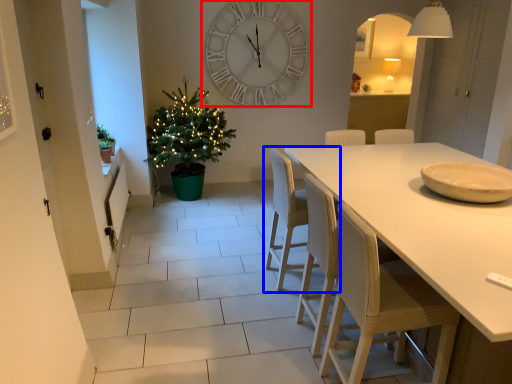
Question: Which object appears closest to the camera in this image, wall clock (highlighted by a red box) or chair (highlighted by a blue box)?

Choices:
 (A) wall clock
 (B) chair

Answer: (B)